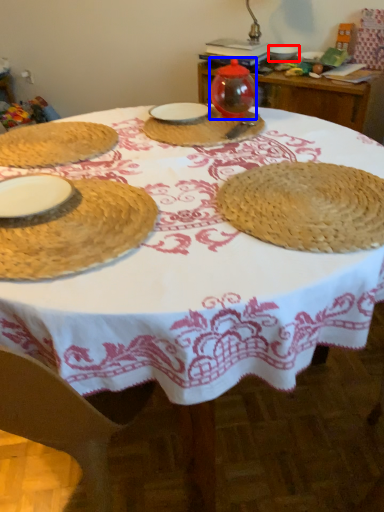
Question: Which object is further to the camera taking this photo, tableware (highlighted by a red box) or tableware (highlighted by a blue box)?

Choices:
 (A) tableware
 (B) tableware

Answer: (A)